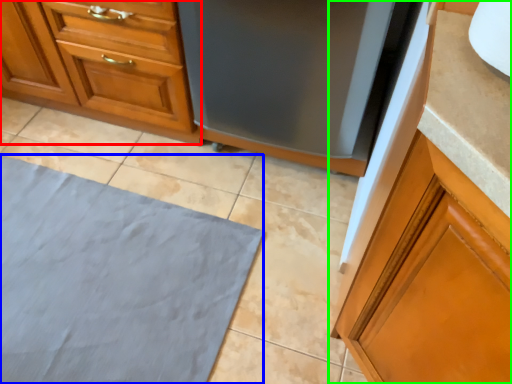
Question: Considering the real-world distances, which object is farthest from cabinetry (highlighted by a red box)? bath mat (highlighted by a blue box) or cabinetry (highlighted by a green box)?

Choices:
 (A) bath mat
 (B) cabinetry

Answer: (B)